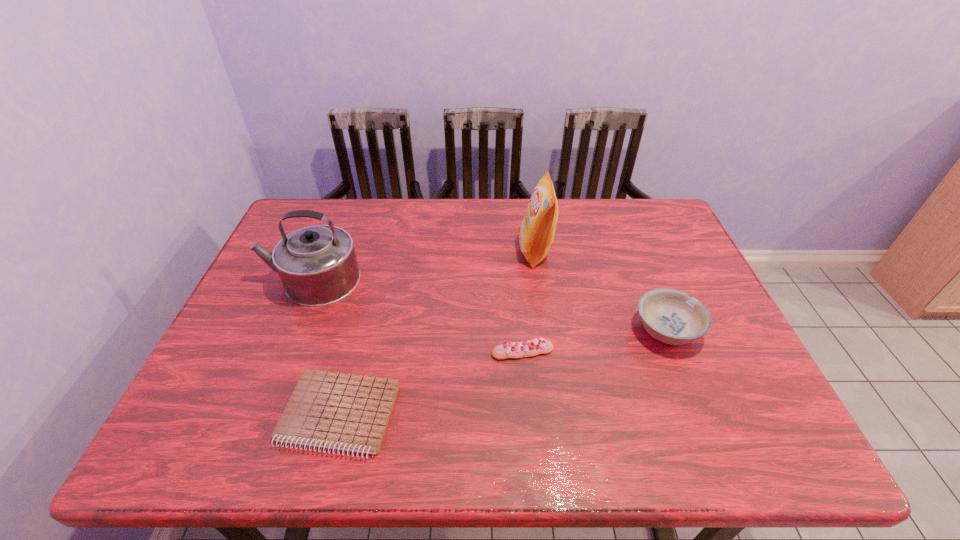
The width and height of the screenshot is (960, 540). In order to click on crisp (potato chip) in this screenshot , I will do `click(536, 232)`.

I want to click on kettle, so click(317, 265).

Where is `the rightmost object`? This screenshot has height=540, width=960. the rightmost object is located at coordinates (671, 316).

Locate an element on the screen. The height and width of the screenshot is (540, 960). bowl is located at coordinates (671, 316).

Image resolution: width=960 pixels, height=540 pixels. What are the coordinates of `the second shortest object` in the screenshot? It's located at (534, 347).

Find the location of `notebook`. notebook is located at coordinates point(346,412).

Where is `the nearest object`? Image resolution: width=960 pixels, height=540 pixels. the nearest object is located at coordinates (346, 412).

Find the location of `vacant space located 0.270m on the front-facing side of the crisp (potato chip)`. vacant space located 0.270m on the front-facing side of the crisp (potato chip) is located at coordinates (430, 251).

Where is `vacant region located 0.190m on the front-facing side of the crisp (potato chip)`? The height and width of the screenshot is (540, 960). vacant region located 0.190m on the front-facing side of the crisp (potato chip) is located at coordinates (456, 251).

This screenshot has height=540, width=960. In order to click on vacant space located 0.080m on the front-facing side of the crisp (potato chip) in this screenshot , I will do `click(492, 251)`.